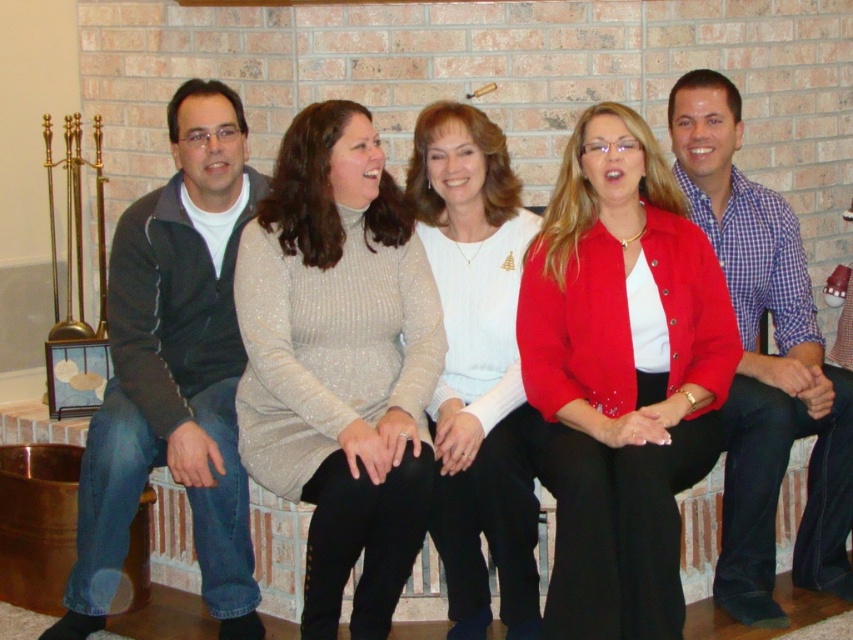
You are standing in front of the fireplace mantel where five people are seated. You need to place a gift box exactly at the center of the matte red jacket at center. What coordinates should you target?

The coordinates to target are point (621,376), as that is where the matte red jacket at center is located.